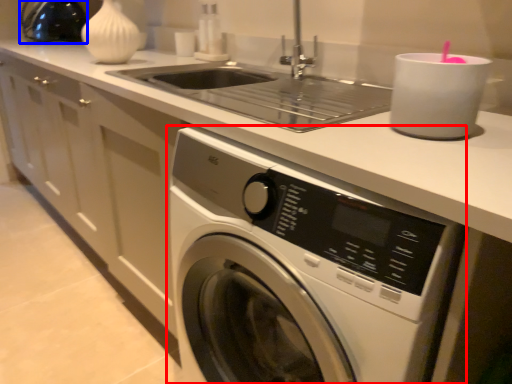
Question: Which object appears farthest to the camera in this image, washing machine (highlighted by a red box) or appliance (highlighted by a blue box)?

Choices:
 (A) washing machine
 (B) appliance

Answer: (B)